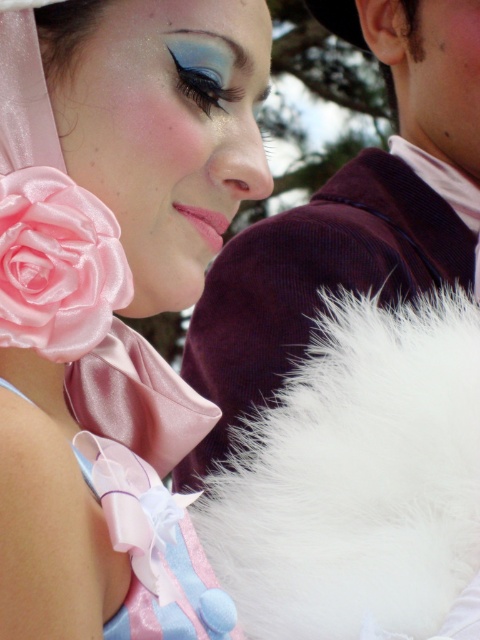
Is point (474, 445) positioned before point (32, 200)?

No, it is behind (32, 200).

The width and height of the screenshot is (480, 640). What are the coordinates of `white fluffy fur at right` in the screenshot? It's located at (358, 481).

Does velvet maroon coat at upper right appear under satin rose at left?

No, velvet maroon coat at upper right is not below satin rose at left.

Is velvet maroon coat at upper right further to the viewer compared to satin rose at left?

That is True.

This screenshot has height=640, width=480. Find the location of `velvet maroon coat at upper right`. velvet maroon coat at upper right is located at coordinates (313, 282).

Where is `velvet maroon coat at upper right`? The width and height of the screenshot is (480, 640). velvet maroon coat at upper right is located at coordinates (313, 282).

How far apart are satin pink rose at upper left and white fluffy fur at right?

satin pink rose at upper left and white fluffy fur at right are 10.48 inches apart from each other.

Does satin pink rose at upper left appear on the left side of white fluffy fur at right?

Correct, you'll find satin pink rose at upper left to the left of white fluffy fur at right.

What do you see at coordinates (112, 300) in the screenshot? This screenshot has width=480, height=640. I see `satin pink rose at upper left` at bounding box center [112, 300].

Locate an element on the screen. This screenshot has width=480, height=640. satin pink rose at upper left is located at coordinates coord(112,300).